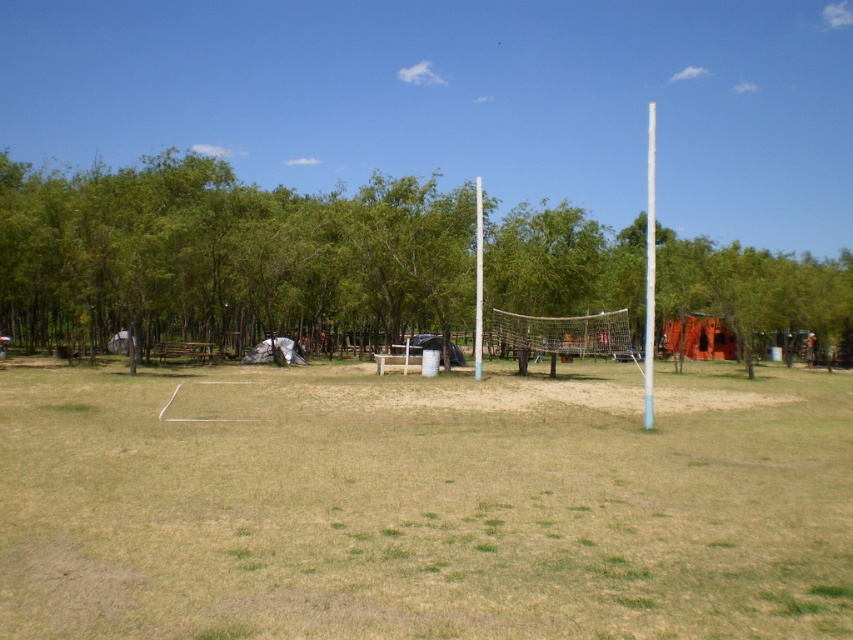
You are standing at the center of the volleyball court and want to place a 1.5 meter long volleyball net pole. Is the blue plastic pole at right positioned far enough away from you to accommodate the pole?

The blue plastic pole at right is 16.02 meters away from the viewer. Since the volleyball net pole is only 1.5 meters long, there is sufficient space between you and the blue plastic pole at right to place the pole.

You are standing at the edge of the volleyball court and want to walk straight towards the white metallic pole at center. Will you pass by the green leafy tree at center on your left or right side?

The green leafy tree at center is positioned on the left side of white metallic pole at center, so when walking towards the white metallic pole at center, you will pass by the green leafy tree at center on your left side.